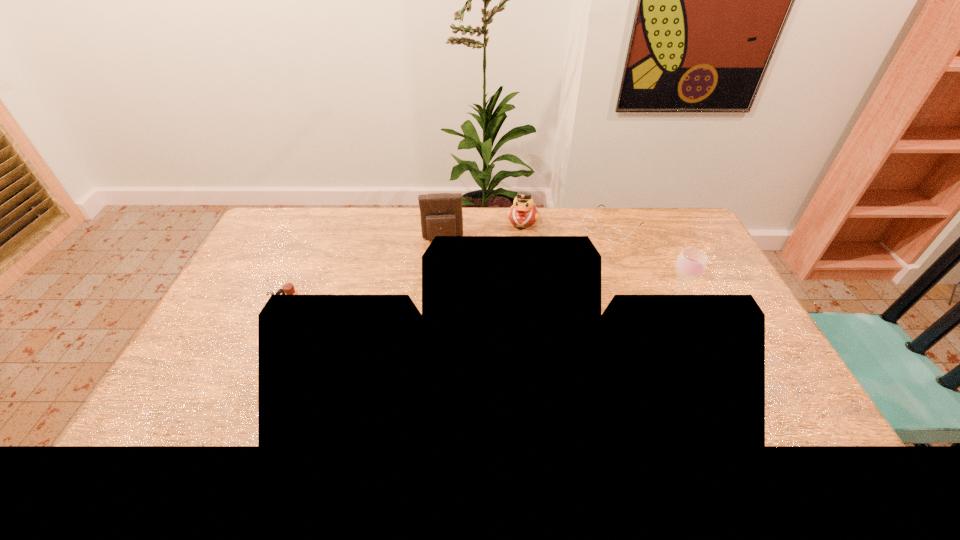
This screenshot has height=540, width=960. I want to click on free region that satisfies the following two spatial constraints: 1. on the front side of the duck; 2. on the left side of the shortest object, so click(x=524, y=227).

The image size is (960, 540). Find the location of `vacant space that satisfies the following two spatial constraints: 1. on the back side of the third object from left to right; 2. on the right side of the pouch`. vacant space that satisfies the following two spatial constraints: 1. on the back side of the third object from left to right; 2. on the right side of the pouch is located at coordinates (444, 220).